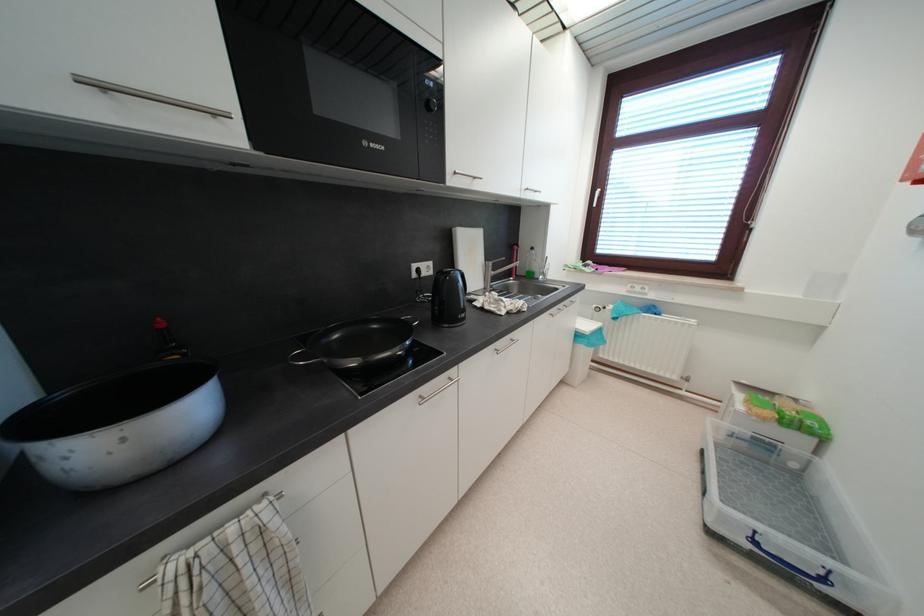
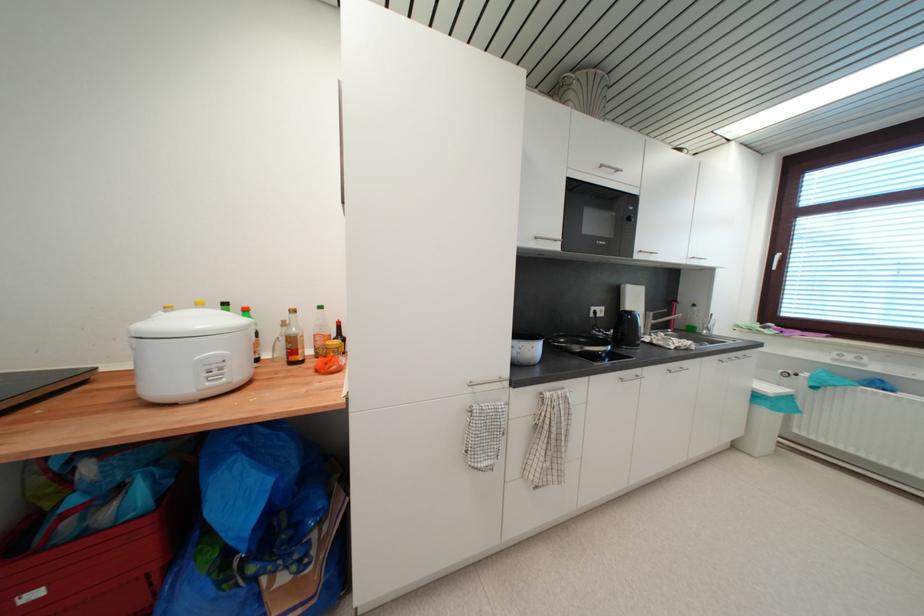
Find the pixel in the second image that matches the point at 419,278 in the first image.

(597, 317)